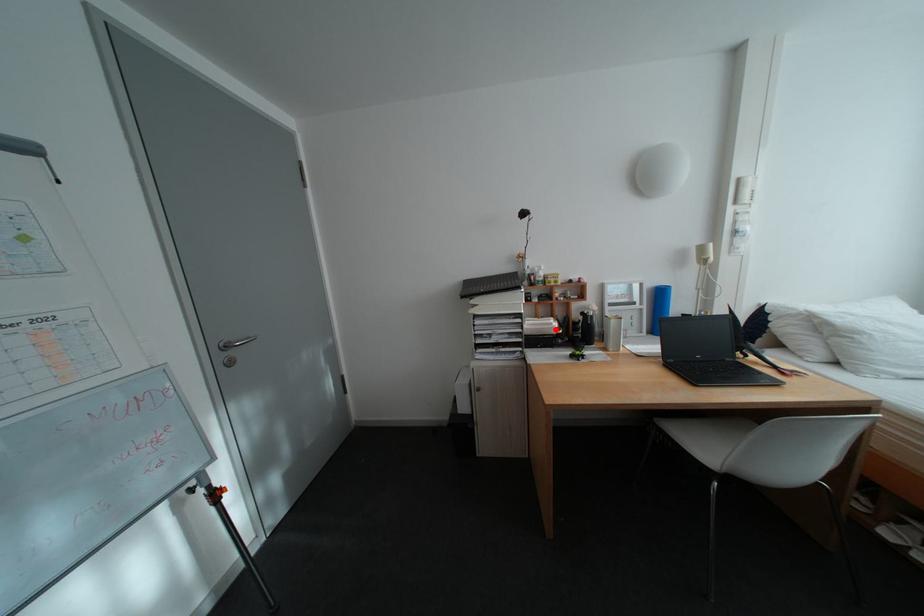
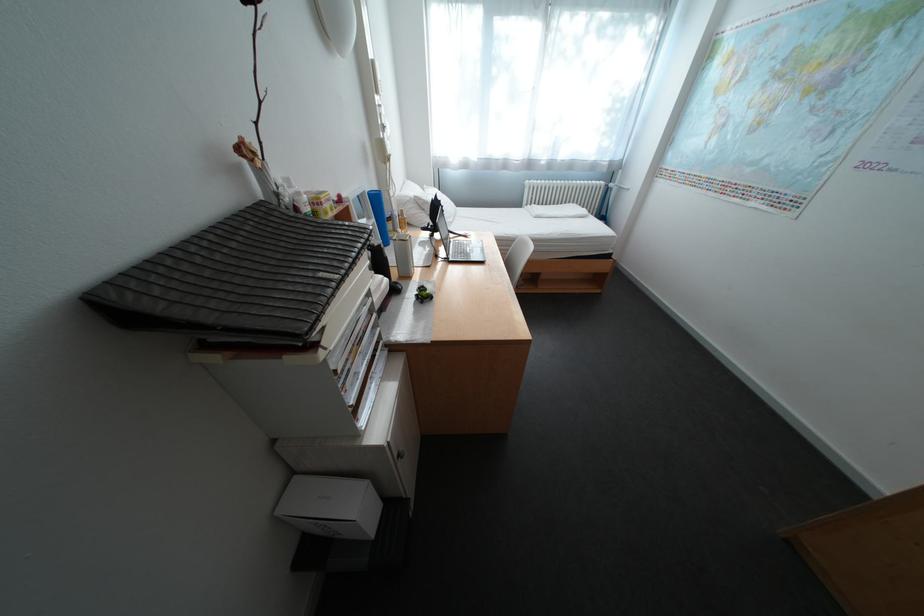
Where in the second image is the point corresponding to the highlighted location from the first image?

(395, 292)